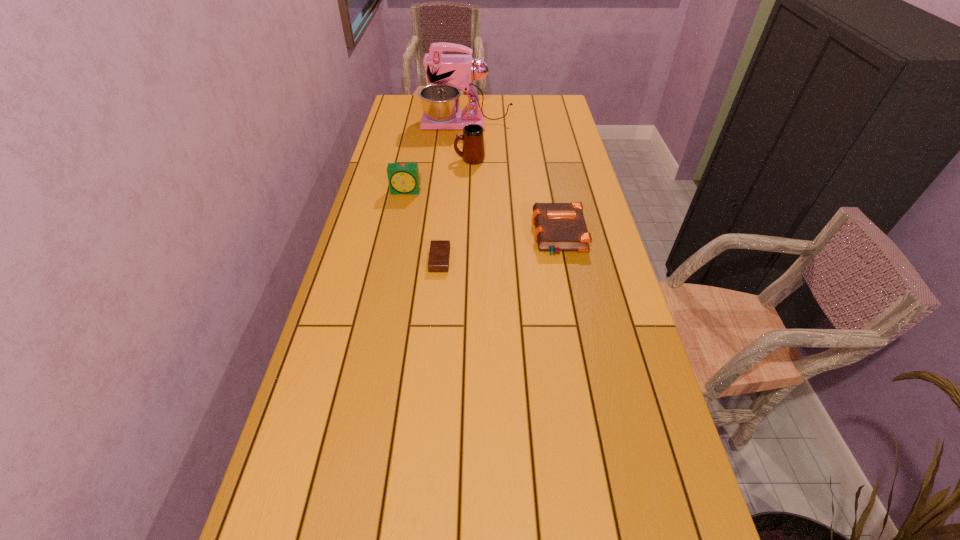
Find the location of `mixer`. mixer is located at coordinates (440, 102).

The height and width of the screenshot is (540, 960). Find the location of `the farthest object`. the farthest object is located at coordinates (440, 102).

In order to click on the fourth shortest object in this screenshot , I will do `click(473, 152)`.

Identify the location of the second farthest object. This screenshot has height=540, width=960. (473, 152).

Locate an element on the screen. The image size is (960, 540). the taller alarm clock is located at coordinates (403, 178).

What are the coordinates of `the farther alarm clock` in the screenshot? It's located at (403, 178).

In order to click on Bible in this screenshot , I will do `click(559, 227)`.

This screenshot has height=540, width=960. I want to click on the second shortest object, so click(559, 227).

Find the location of a particular element. Image resolution: width=960 pixels, height=540 pixels. the nearer alarm clock is located at coordinates (439, 253).

Locate an element on the screen. the shorter alarm clock is located at coordinates (439, 253).